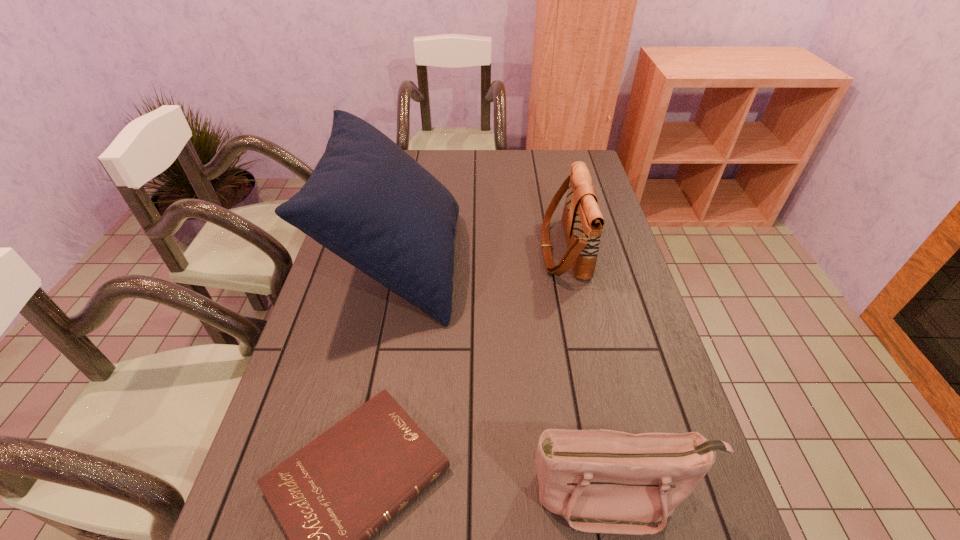
Identify which object is the closest to the farther shoulder bag. Please provide its 2D coordinates. Your answer should be formatted as a tuple, i.e. [(x, y)], where the tuple contains the x and y coordinates of a point satisfying the conditions above.

[(369, 202)]

At what (x,y) coordinates should I click in order to perform the action: click on vacant point that satisfies the following two spatial constraints: 1. on the front-facing side of the taller shoulder bag; 2. on the front pocket of the third tallest object. Please return your answer as a coordinate pair (x, y). The height and width of the screenshot is (540, 960). Looking at the image, I should click on (615, 493).